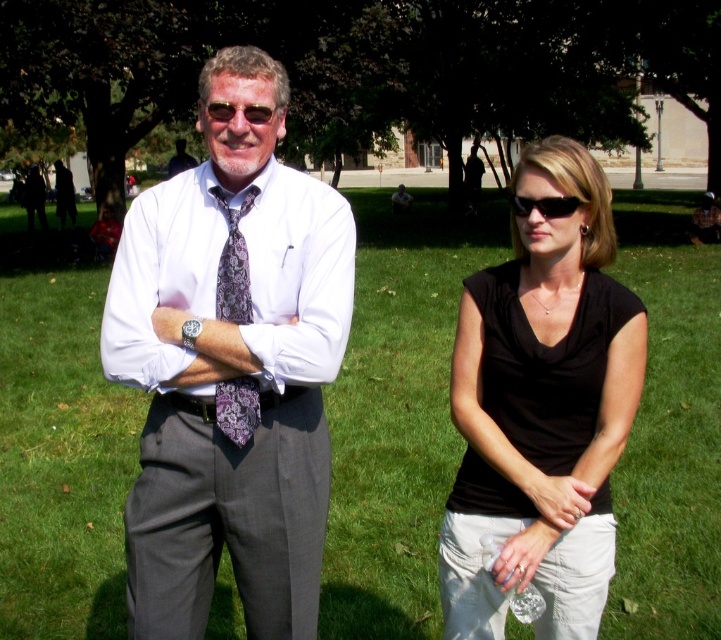
Question: Does black matte shirt at center have a greater width compared to matte black shirt at left?

Choices:
 (A) no
 (B) yes

Answer: (A)

Question: Which of the following is the closest to the observer?

Choices:
 (A) matte black shirt at left
 (B) matte gray suit at left
 (C) white cotton dress shirt at center

Answer: (C)

Question: Is green grass at center thinner than black matte shirt at center?

Choices:
 (A) yes
 (B) no

Answer: (B)

Question: Estimate the real-world distances between objects in this image. Which object is closer to the purple floral tie at center?

Choices:
 (A) matte black shirt at left
 (B) green grass at center
 (C) black matte shirt at center
 (D) white cotton dress shirt at center

Answer: (D)

Question: Considering the real-world distances, which object is farthest from the green grass at center?

Choices:
 (A) purple floral tie at center
 (B) matte black shirt at left
 (C) white cotton dress shirt at center
 (D) black matte shirt at center

Answer: (B)

Question: Does green grass at center appear under matte black shirt at left?

Choices:
 (A) yes
 (B) no

Answer: (A)